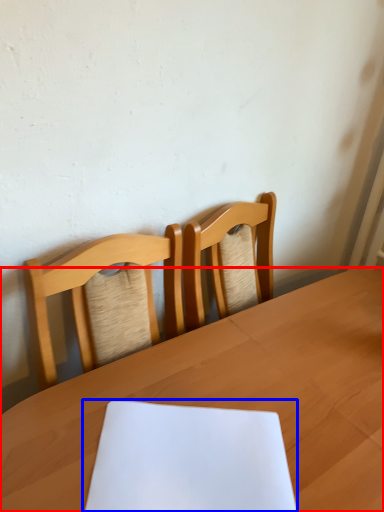
Question: Which object appears closest to the camera in this image, table (highlighted by a red box) or notebook (highlighted by a blue box)?

Choices:
 (A) table
 (B) notebook

Answer: (A)